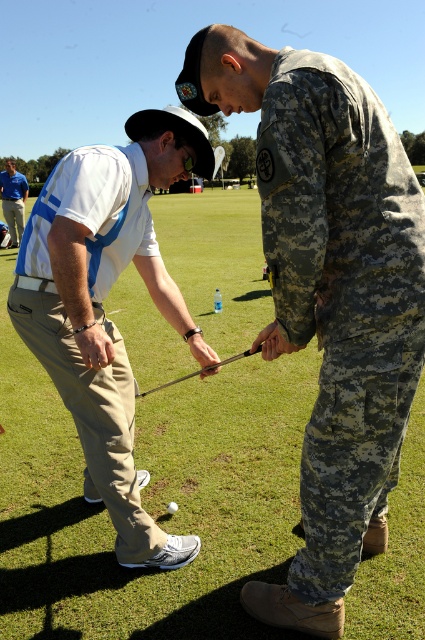
Question: Among these objects, which one is farthest from the camera?

Choices:
 (A) white matte golf ball at center
 (B) metallic shaft at center

Answer: (A)

Question: Does metallic shaft at center have a lesser width compared to white matte golf ball at center?

Choices:
 (A) yes
 (B) no

Answer: (B)

Question: Which of these objects is positioned closest to the metallic shaft at center?

Choices:
 (A) green grass at center
 (B) camouflage fabric pants at center

Answer: (B)

Question: Can you confirm if white matte golf club at center is positioned to the left of white matte golf ball at center?

Choices:
 (A) no
 (B) yes

Answer: (B)

Question: Considering the real-world distances, which object is closest to the white matte golf ball at center?

Choices:
 (A) blue shirt at center
 (B) green grass at center

Answer: (B)

Question: Can you confirm if green grass at center is positioned to the right of camouflage fabric pants at center?

Choices:
 (A) no
 (B) yes

Answer: (A)